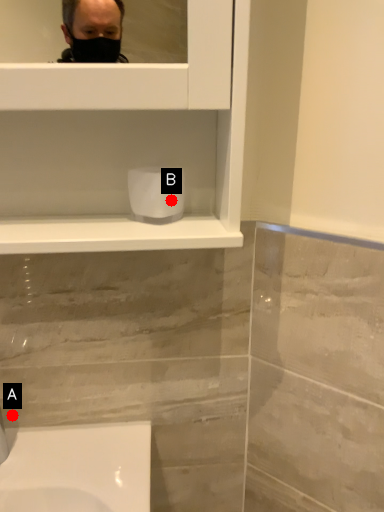
Question: Two points are circled on the image, labeled by A and B beside each circle. Which point is closer to the camera taking this photo?

Choices:
 (A) A is closer
 (B) B is closer

Answer: (B)